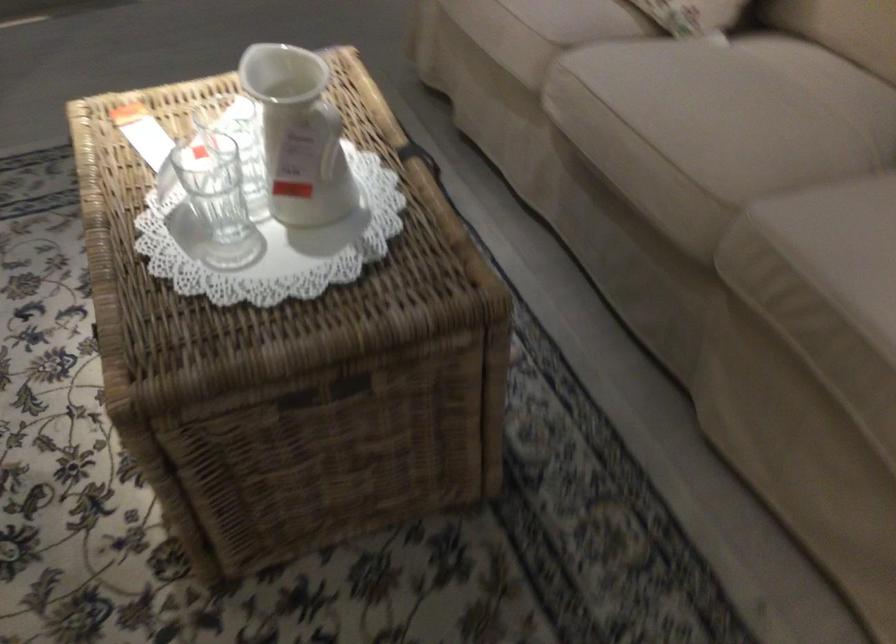
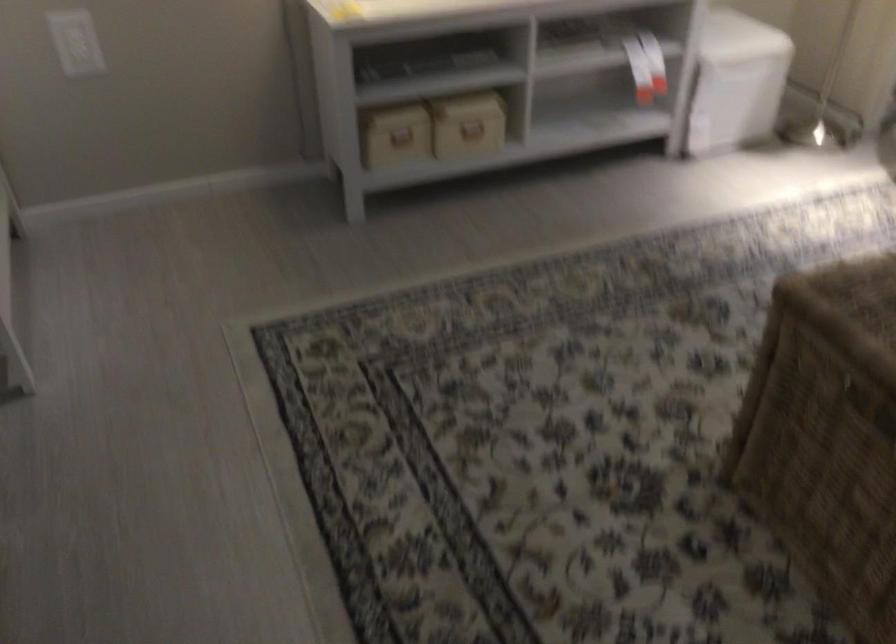
Based on the continuous images, in which direction is the camera rotating?

The camera rotated toward left-down.